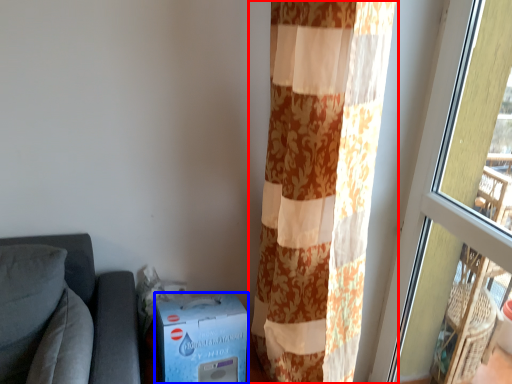
Question: Which of the following is the farthest to the observer, curtain (highlighted by a red box) or cardboard box (highlighted by a blue box)?

Choices:
 (A) curtain
 (B) cardboard box

Answer: (B)